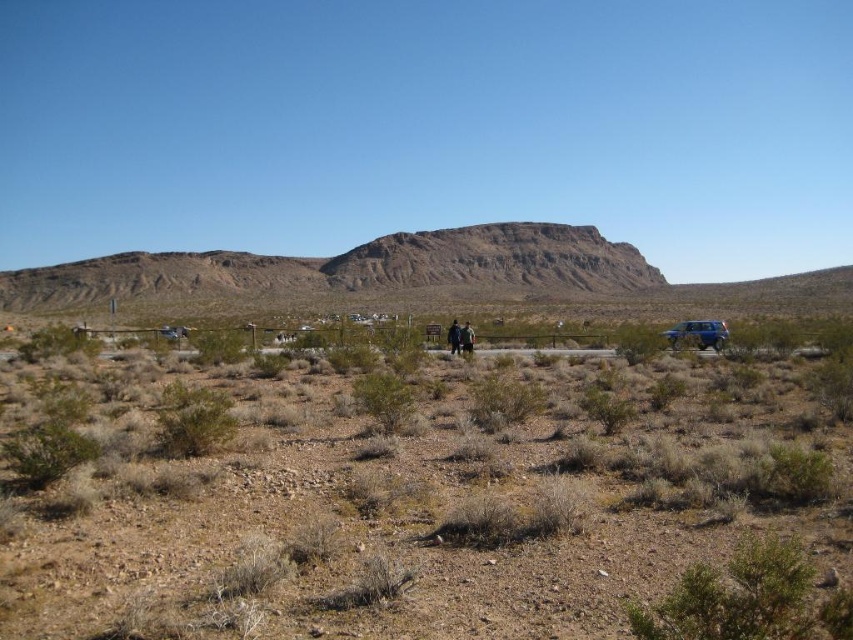
In the scene shown: Can you confirm if rugged brown rock at center is wider than blue metallic jeep at lower right?

Yes.

Can you confirm if rugged brown rock at center is positioned above blue metallic jeep at lower right?

Correct, rugged brown rock at center is located above blue metallic jeep at lower right.

Is point (474, 225) farther from camera compared to point (672, 337)?

That is True.

What are the coordinates of `rugged brown rock at center` in the screenshot? It's located at (495, 260).

Does rugged brown mountain at center come in front of brown leather jacket at center?

No, rugged brown mountain at center is behind brown leather jacket at center.

Can you confirm if rugged brown mountain at center is positioned to the left of brown leather jacket at center?

Incorrect, rugged brown mountain at center is not on the left side of brown leather jacket at center.

Does point (381, 276) come closer to viewer compared to point (461, 352)?

That is False.

Where is `rugged brown mountain at center`? The width and height of the screenshot is (853, 640). rugged brown mountain at center is located at coordinates (350, 268).

Which is more to the left, brown sandy dirt field at center or blue metallic jeep at lower right?

From the viewer's perspective, brown sandy dirt field at center appears more on the left side.

Is brown sandy dirt field at center shorter than blue metallic jeep at lower right?

No, brown sandy dirt field at center is not shorter than blue metallic jeep at lower right.

Between point (344, 602) and point (706, 330), which one is positioned behind?

Positioned behind is point (706, 330).

I want to click on brown sandy dirt field at center, so click(x=426, y=499).